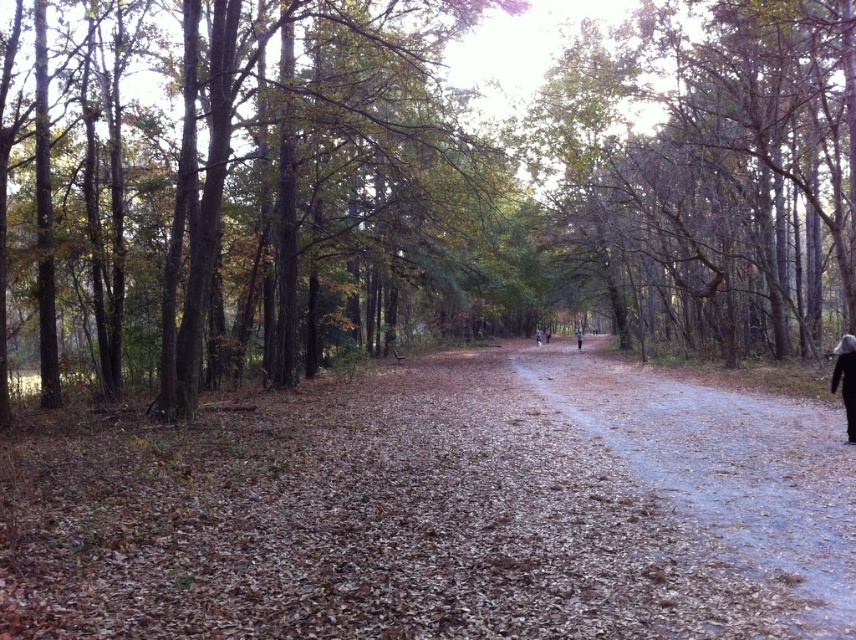
Which is above, brown leafy forest path at center or dark gray woolen coat at right?

dark gray woolen coat at right is higher up.

Does point (313, 538) lie behind point (842, 385)?

No, it is not.

Locate an element on the screen. The image size is (856, 640). brown leafy forest path at center is located at coordinates (438, 508).

Can you confirm if brown wood tree at left is positioned to the left of brown dirt path at center?

Correct, you'll find brown wood tree at left to the left of brown dirt path at center.

You are a GUI agent. You are given a task and a screenshot of the screen. Output one action in this format:
    pyautogui.click(x=<x>, y=<y>)
    Task: Click on the brown wood tree at left
    The height and width of the screenshot is (640, 856).
    Given the screenshot: What is the action you would take?
    tap(265, 189)

Measure the distance between brown wood tree at left and camera.

They are 12.60 meters apart.

The width and height of the screenshot is (856, 640). What are the coordinates of `brown wood tree at left` in the screenshot? It's located at (265, 189).

Looking at this image, does brown leafy forest path at center appear on the left side of brown dirt path at center?

Yes, brown leafy forest path at center is to the left of brown dirt path at center.

Based on the photo, does brown leafy forest path at center have a greater height compared to brown dirt path at center?

Correct, brown leafy forest path at center is much taller as brown dirt path at center.

From the picture: Who is more distant from viewer, (364, 614) or (825, 429)?

Positioned behind is point (825, 429).

Identify the location of brown leafy forest path at center. This screenshot has width=856, height=640. (438, 508).